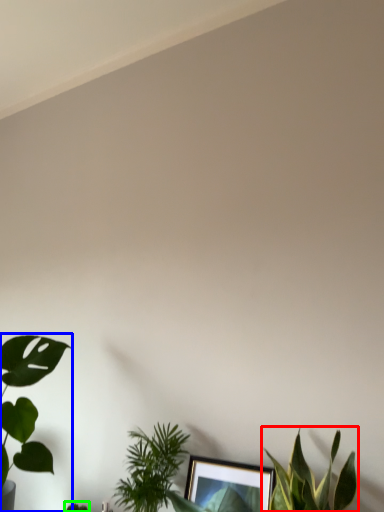
Question: Which is nearer to the houseplant (highlighted by a red box)? houseplant (highlighted by a blue box) or plant (highlighted by a green box).

Choices:
 (A) houseplant
 (B) plant

Answer: (A)